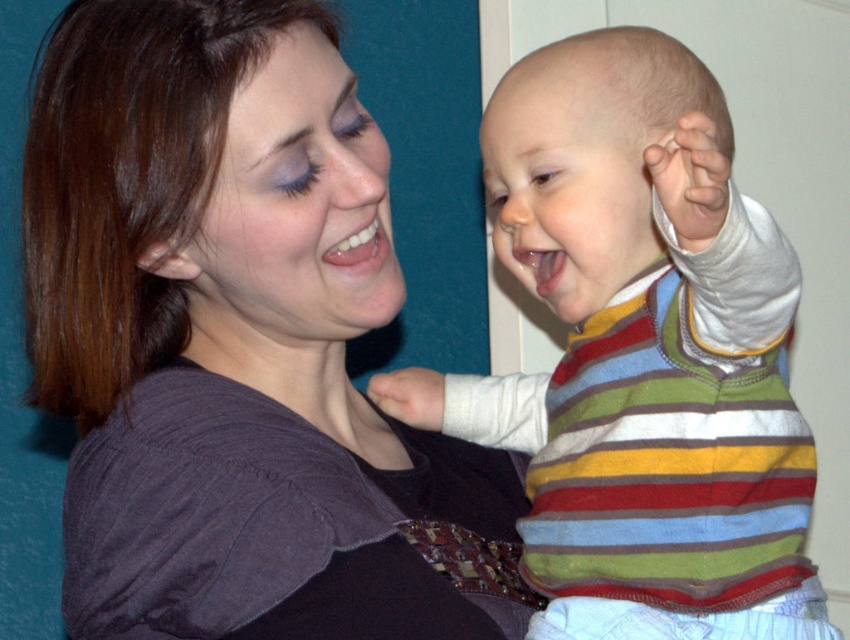
Question: Observing the image, what is the correct spatial positioning of striped sweater at upper right in reference to striped sweater at center?

Choices:
 (A) right
 (B) left

Answer: (B)

Question: Among these objects, which one is farthest from the camera?

Choices:
 (A) striped sweater at upper right
 (B) striped sweater at center

Answer: (A)

Question: Is striped sweater at upper right below striped sweater at center?

Choices:
 (A) no
 (B) yes

Answer: (A)

Question: Which point is closer to the camera?

Choices:
 (A) (233, 224)
 (B) (794, 280)

Answer: (A)

Question: Does striped sweater at upper right have a greater width compared to striped sweater at center?

Choices:
 (A) no
 (B) yes

Answer: (B)